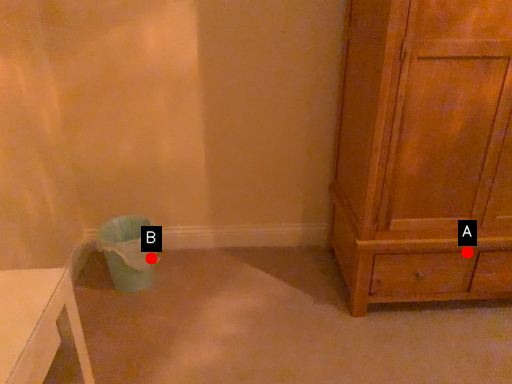
Question: Two points are circled on the image, labeled by A and B beside each circle. Which of the following is the farthest from the observer?

Choices:
 (A) A is further
 (B) B is further

Answer: (B)